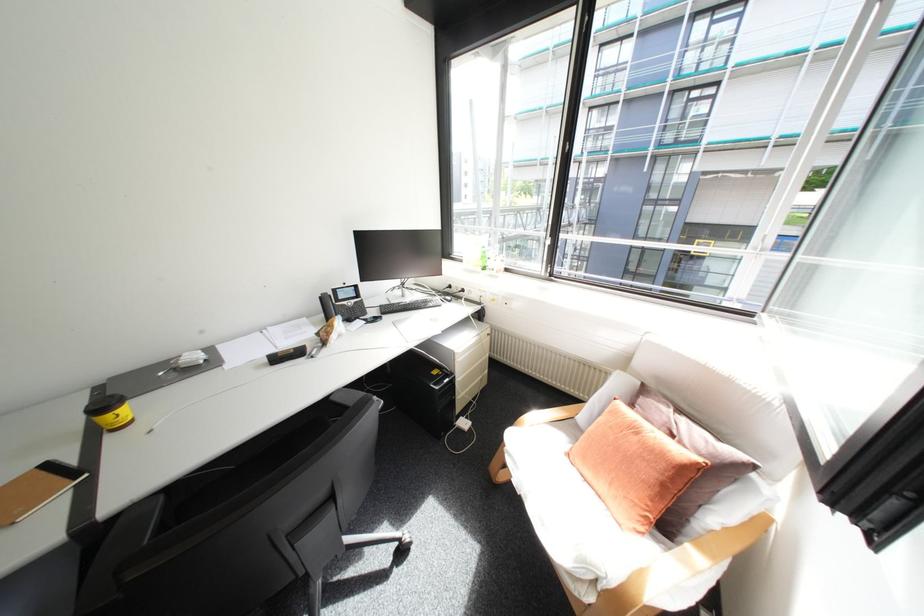
Where is `brown pillow`? The width and height of the screenshot is (924, 616). brown pillow is located at coordinates (690, 459).